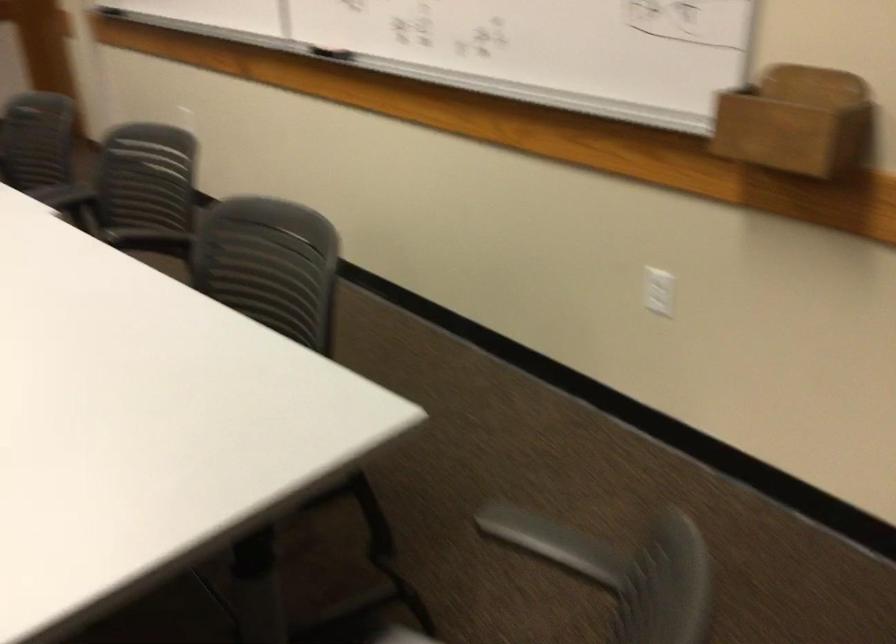
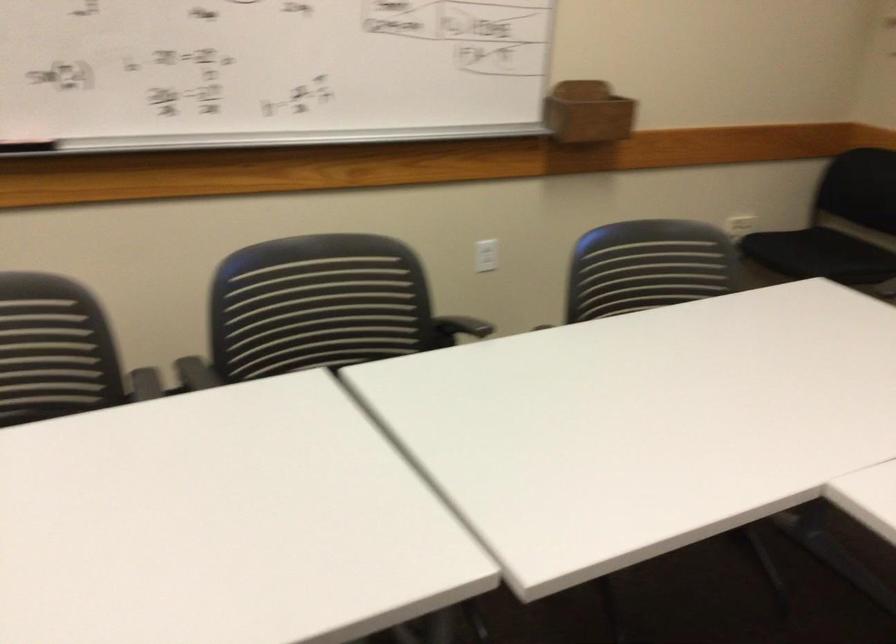
Find the pixel in the second image that matches the point at 159,238 in the first image.

(458, 328)